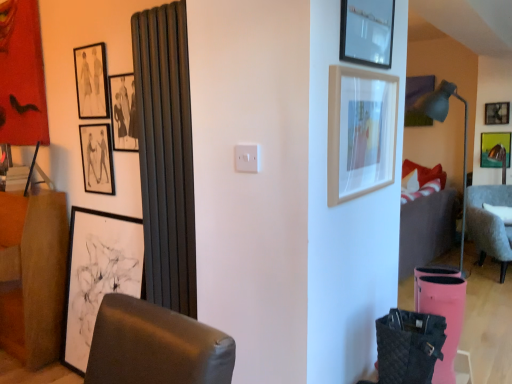
You are a GUI agent. You are given a task and a screenshot of the screen. Output one action in this format:
    pyautogui.click(x=<x>, y=<y>)
    Task: Click on the free point above light wood picture frame at upper right, which ranks as the fifth picture frame in left-to-right order (from a real-world perspective)
    
    Given the screenshot: What is the action you would take?
    pyautogui.click(x=368, y=62)